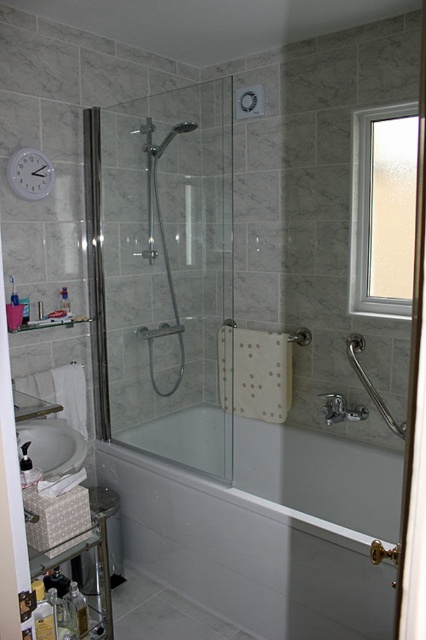
Between clear glass shower door at center and clear glass screen door at right, which one has less height?

clear glass screen door at right is shorter.

Which is behind, point (112, 246) or point (422, 392)?

The point (112, 246) is more distant.

From the picture: Who is more distant from viewer, (196,262) or (406,627)?

The point (196,262) is more distant.

Find the location of a particular element. The image size is (426, 640). clear glass shower door at center is located at coordinates (164, 273).

Can you confirm if clear glass screen door at right is positioned above white glossy sink at lower left?

Yes, clear glass screen door at right is above white glossy sink at lower left.

At what (x,y) coordinates should I click in order to perform the action: click on clear glass screen door at right. Please return your answer as a coordinate pair (x, y). Looking at the image, I should click on (414, 417).

Which is in front, point (425, 593) or point (69, 460)?

Point (425, 593) is in front.

Where is `clear glass screen door at right`? The height and width of the screenshot is (640, 426). clear glass screen door at right is located at coordinates (414, 417).

Measure the distance from clear glass shower door at center to white glossy bathtub at center.

They are 34.11 inches apart.

Describe the element at coordinates (164, 273) in the screenshot. This screenshot has height=640, width=426. I see `clear glass shower door at center` at that location.

Is point (161, 160) positioned behind point (325, 515)?

Yes, it is behind point (325, 515).

What are the coordinates of `clear glass shower door at center` in the screenshot? It's located at (164, 273).